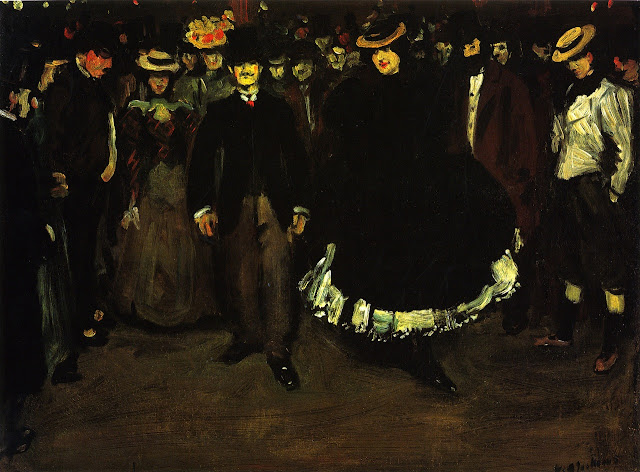
This screenshot has height=472, width=640. Find the location of `painting`. painting is located at coordinates (317, 256).